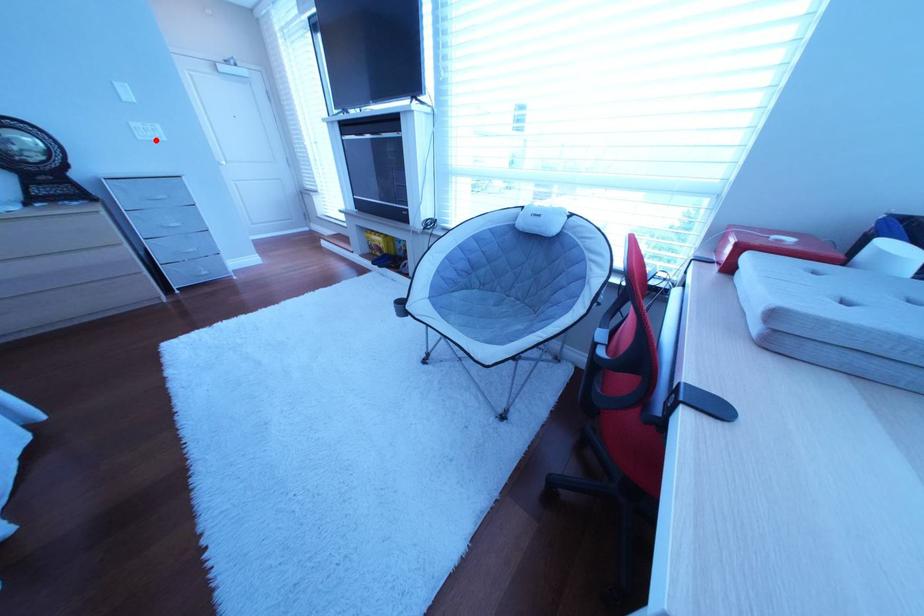
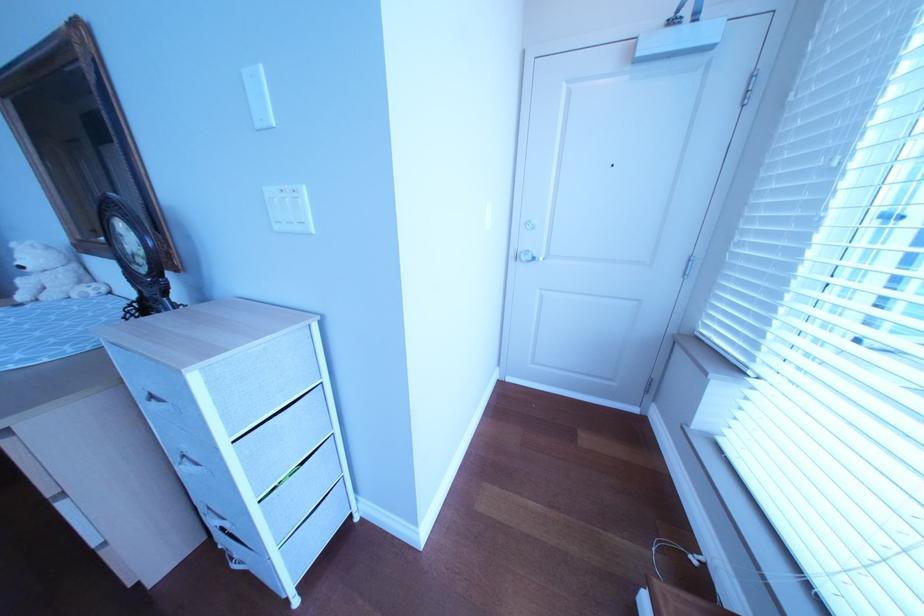
Locate, in the second image, the point that corresponds to the highlighted location in the first image.

(292, 229)